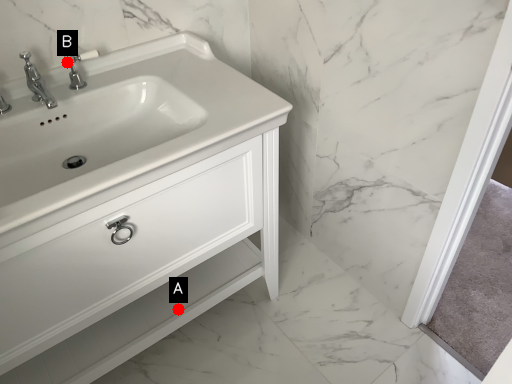
Question: Two points are circled on the image, labeled by A and B beside each circle. Which point is farther from the camera taking this photo?

Choices:
 (A) A is further
 (B) B is further

Answer: (A)